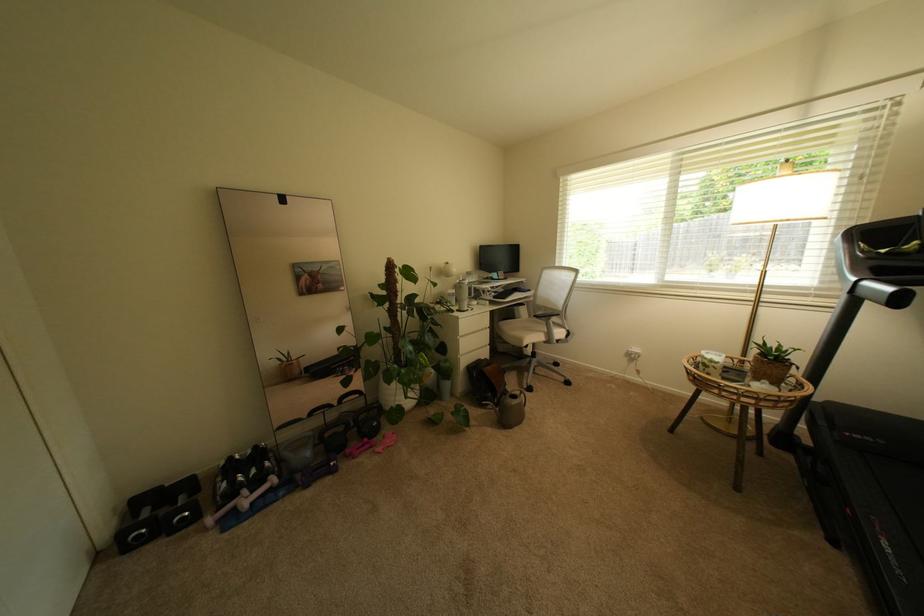
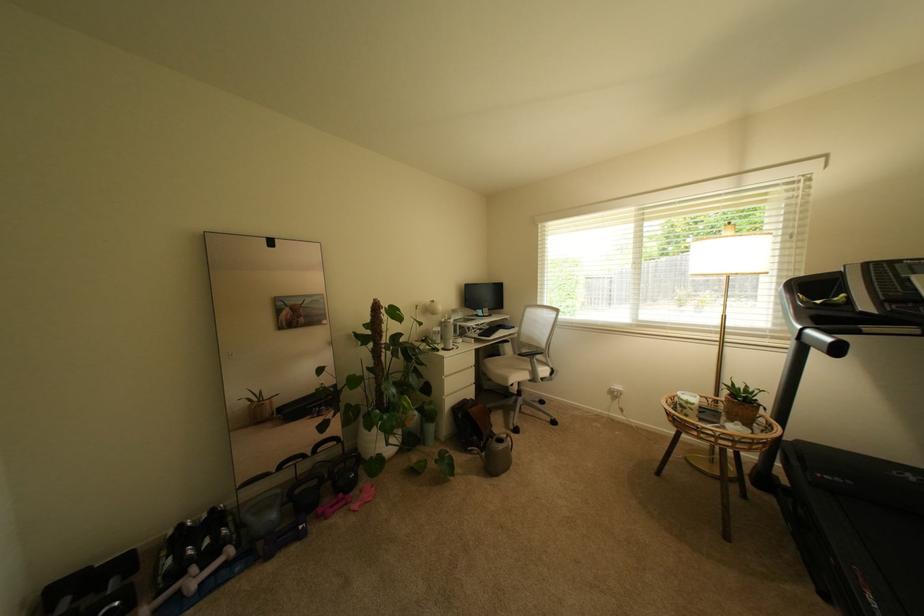
Find the pixel in the second image that matches the point at 554,331 in the first image.

(540, 370)